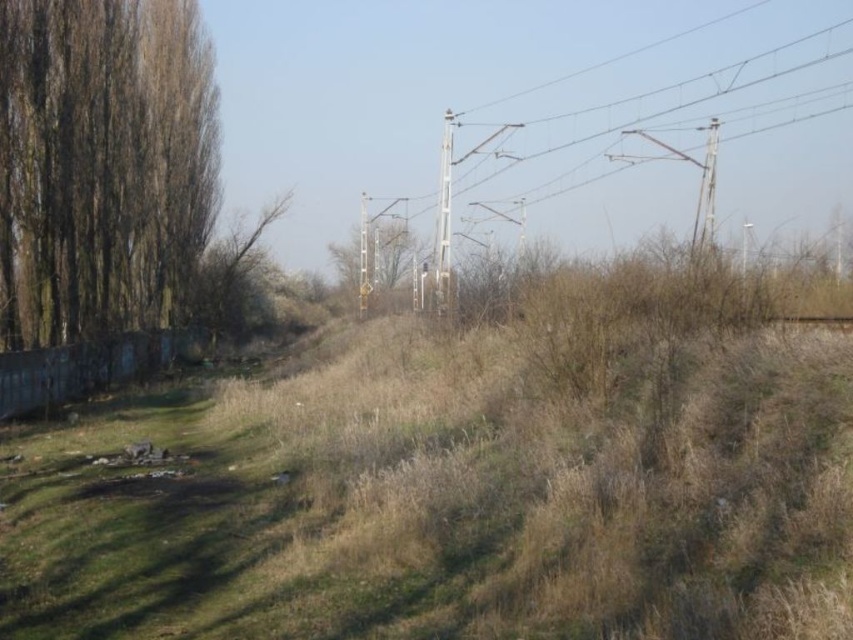
You are a bird looking for a higher perch to survey the landscape. You see a brown rough bark tree at left and a green leafy tree at left. Which tree should you choose to get a better view?

The brown rough bark tree at left is much taller than the green leafy tree at left, so you should choose the brown rough bark tree at left to get a better view.

Consider the image. You are a hiker trying to navigate through this area. You see a brown rough bark tree at left and a green matte signpost at center. Which object would you look up to see first if you are approaching from the right side of the image?

The brown rough bark tree at left is much taller than the green matte signpost at center, so you would see the brown rough bark tree at left first when approaching from the right side.

From the picture: You are planning to plant a new tree in this area. The brown rough bark tree at left has a trunk width of 30 cm, and the green leafy tree at left has a trunk width of 45 cm. If you want to plant a tree with a trunk width between these two, which existing tree should you use as a reference for spacing requirements?

The green leafy tree at left has a wider trunk width of 45 cm, so you should use it as a reference for spacing requirements to ensure adequate space for the new tree.